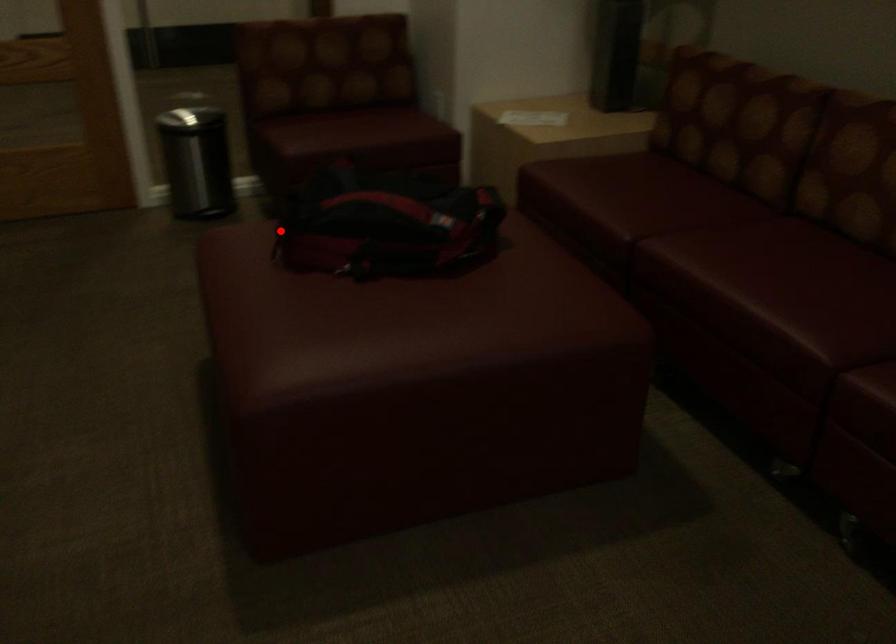
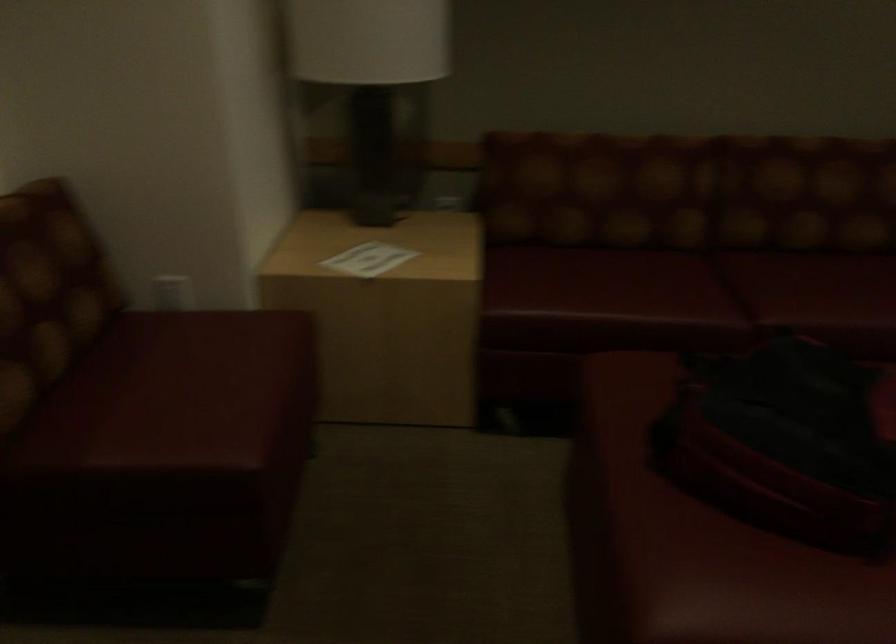
Question: I am providing you with two images of the same scene from different viewpoints. A red point is shown in image1. For the corresponding object point in image2, is it positioned nearer or farther from the camera?

Choices:
 (A) Nearer
 (B) Farther

Answer: (A)